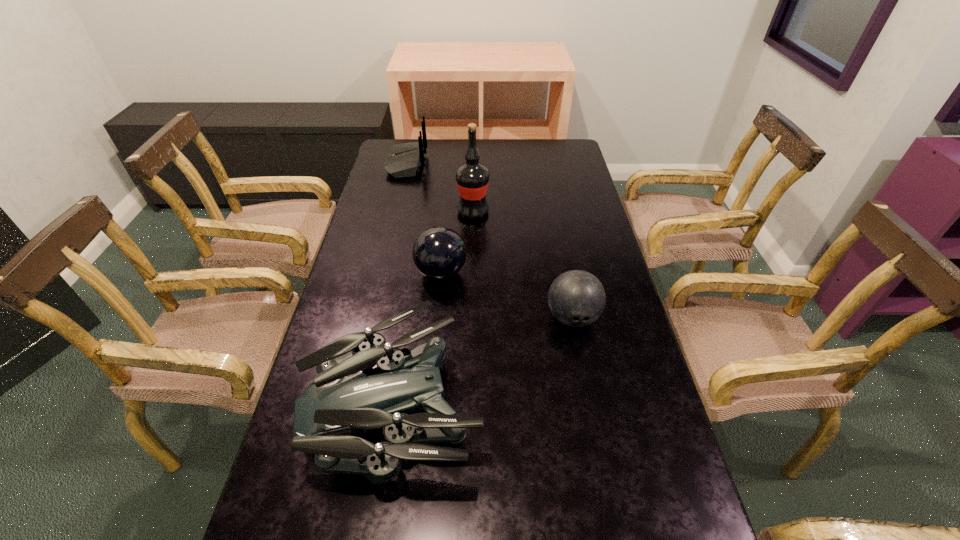
Identify the location of wine bottle. (472, 178).

Locate an element on the screen. This screenshot has height=540, width=960. the tallest object is located at coordinates (472, 178).

This screenshot has height=540, width=960. Find the location of `the farthest object`. the farthest object is located at coordinates (404, 160).

At what (x,y) coordinates should I click in order to perform the action: click on the third nearest object. Please return your answer as a coordinate pair (x, y). Image resolution: width=960 pixels, height=540 pixels. Looking at the image, I should click on (439, 253).

Image resolution: width=960 pixels, height=540 pixels. Find the location of `the left bowling ball`. the left bowling ball is located at coordinates (439, 253).

Identify the location of the nearer bowling ball. (576, 298).

This screenshot has width=960, height=540. I want to click on the rightmost object, so click(576, 298).

Locate an element on the screen. This screenshot has width=960, height=540. drone is located at coordinates (342, 403).

I want to click on blank space located 0.330m on the back of the tallest object, so click(x=474, y=157).

Find the location of `vacant area situated 0.180m on the back of the farthest object`. vacant area situated 0.180m on the back of the farthest object is located at coordinates (470, 164).